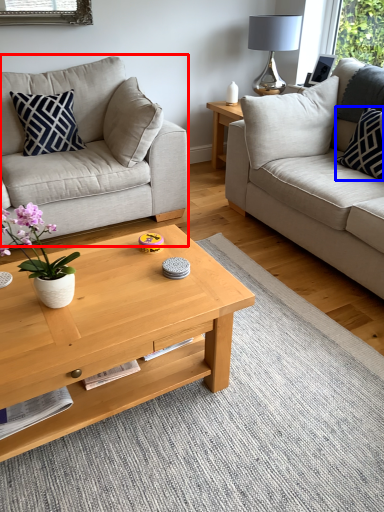
Question: Which of the following is the closest to the observer, studio couch (highlighted by a red box) or pillow (highlighted by a blue box)?

Choices:
 (A) studio couch
 (B) pillow

Answer: (A)